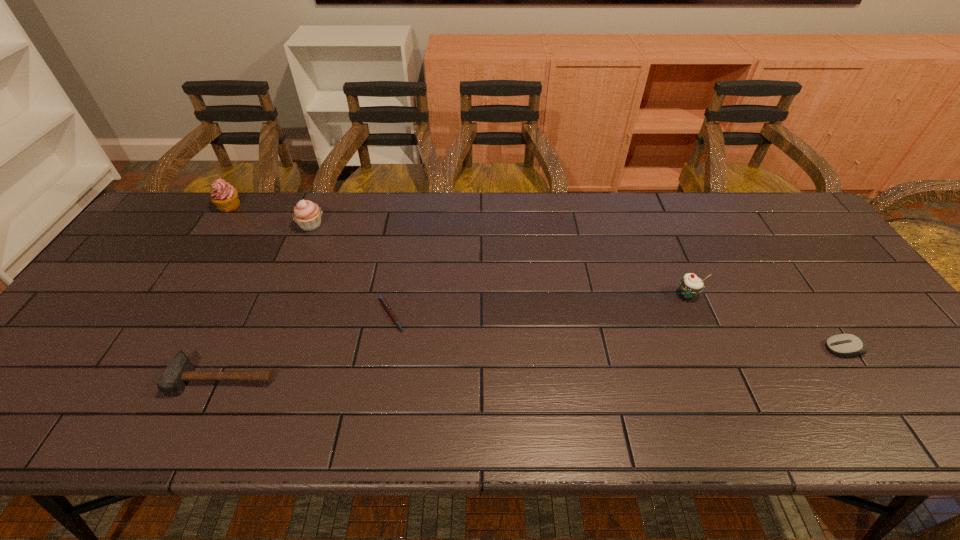
Find the location of a particular element. Image resolution: width=960 pixels, height=540 pixels. the fourth object from left to right is located at coordinates (387, 308).

Find the location of `blank space located on the front of the farthest object`. blank space located on the front of the farthest object is located at coordinates (173, 293).

Find the location of a particular element. This screenshot has height=540, width=960. vacant region located on the left of the second cupcake from left to right is located at coordinates (167, 226).

Find the location of a particular element. Image resolution: width=960 pixels, height=540 pixels. vacant space located 0.060m on the left of the second object from right to left is located at coordinates (653, 294).

The width and height of the screenshot is (960, 540). What are the coordinates of `vacant region located on the striking surface of the hammer` in the screenshot? It's located at (205, 418).

Locate an element on the screen. The image size is (960, 540). free space located 0.220m on the wheel side of the fifth farthest object is located at coordinates (732, 349).

You are a GUI agent. You are given a task and a screenshot of the screen. Output one action in this format:
    pyautogui.click(x=<x>, y=<y>)
    Task: Click on the blank space located 0.200m on the wheel side of the fifth farthest object
    
    Given the screenshot: What is the action you would take?
    pyautogui.click(x=741, y=349)

Locate an element on the screen. This screenshot has width=960, height=540. free space located 0.200m on the wheel side of the fifth farthest object is located at coordinates (741, 349).

This screenshot has height=540, width=960. In order to click on vacant region located 0.390m at the nib of the shortest object in this screenshot , I will do `click(560, 315)`.

Where is `object that is at the left edge`? The image size is (960, 540). object that is at the left edge is located at coordinates (224, 196).